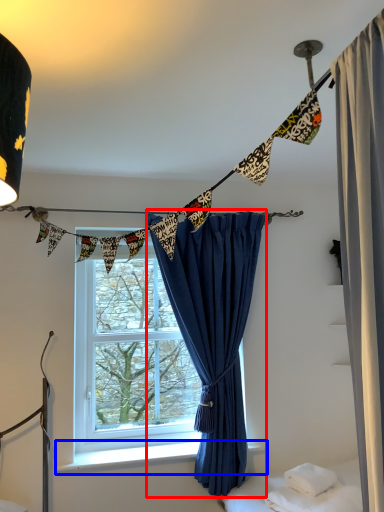
Question: Which of the following is the closest to the observer, curtain (highlighted by a red box) or window sill (highlighted by a blue box)?

Choices:
 (A) curtain
 (B) window sill

Answer: (A)